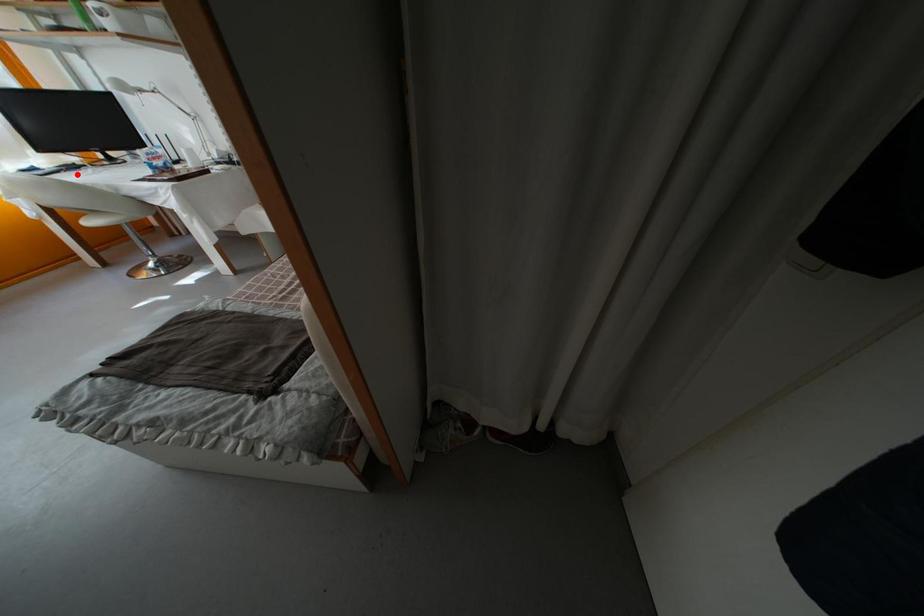
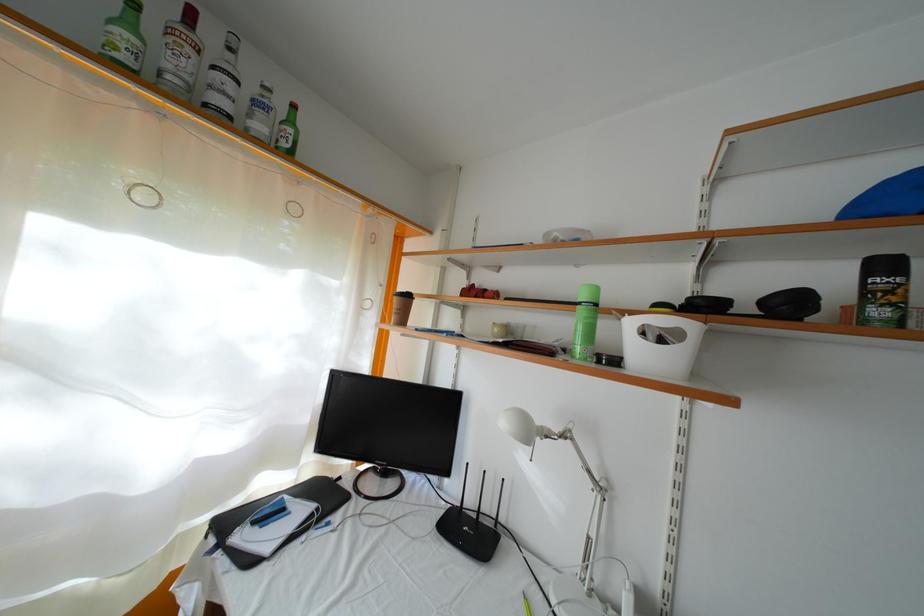
Where in the second image is the point corresponding to the highlighted location from the first image?

(334, 506)